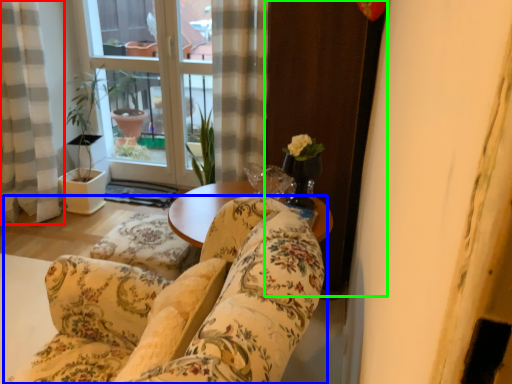
Question: Which object is the closest to the curtain (highlighted by a red box)? Choose among these: studio couch (highlighted by a blue box) or screen door (highlighted by a green box).

Choices:
 (A) studio couch
 (B) screen door

Answer: (B)